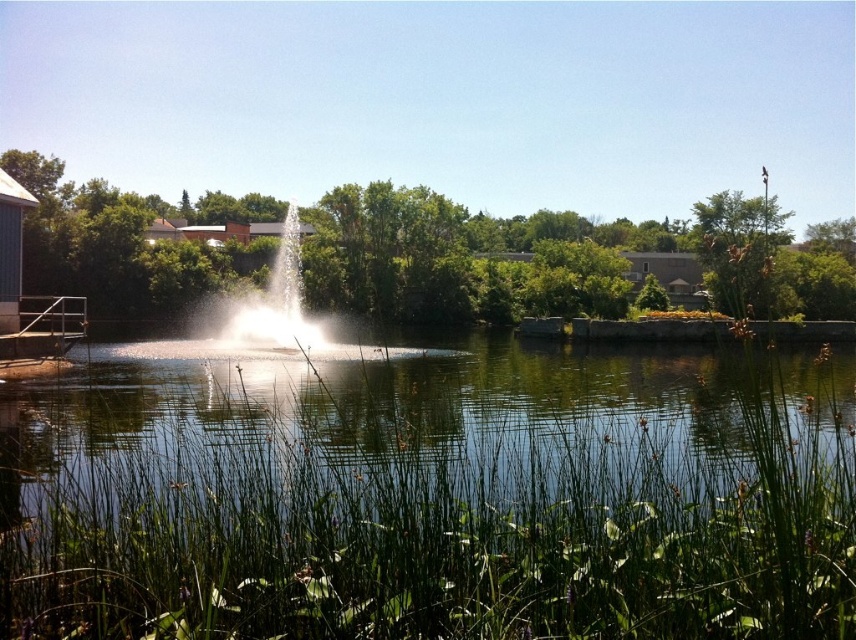
Question: Observing the image, what is the correct spatial positioning of clear water at center in reference to white frothy water at center?

Choices:
 (A) below
 (B) above

Answer: (A)

Question: Is clear water at center above white frothy water at center?

Choices:
 (A) yes
 (B) no

Answer: (B)

Question: Is clear water at center behind white frothy water at center?

Choices:
 (A) no
 (B) yes

Answer: (A)

Question: Which point is farther to the camera?

Choices:
 (A) clear water at center
 (B) white frothy water at center

Answer: (B)